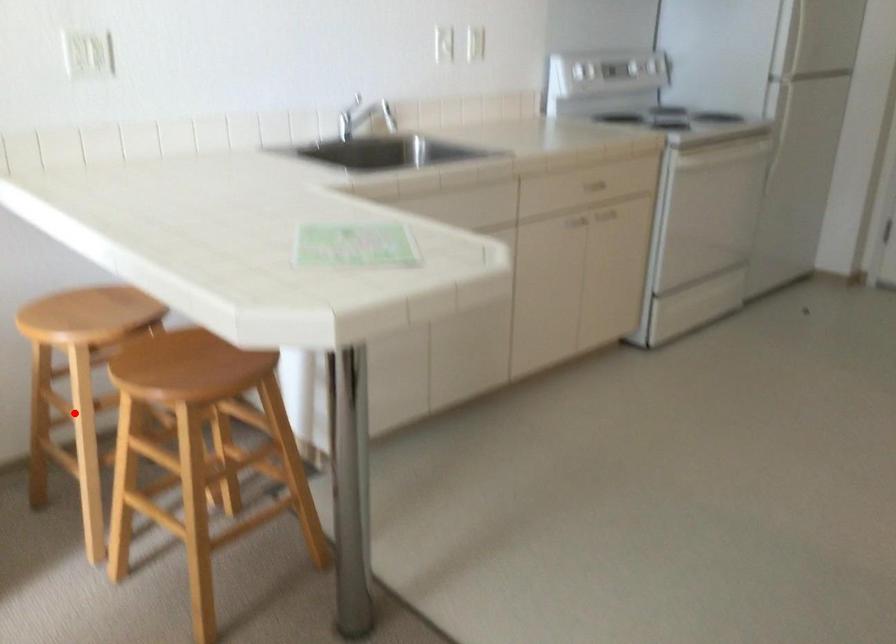
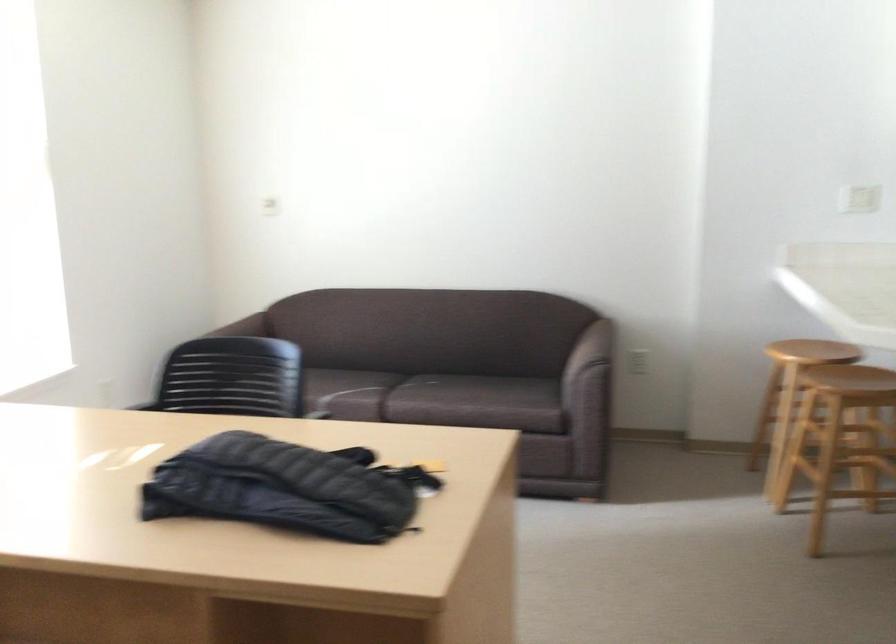
Question: I am providing you with two images of the same scene from different viewpoints. Given a red point in image1, look at the same physical point in image2. Is it:

Choices:
 (A) Closer to the viewpoint
 (B) Farther from the viewpoint

Answer: (B)